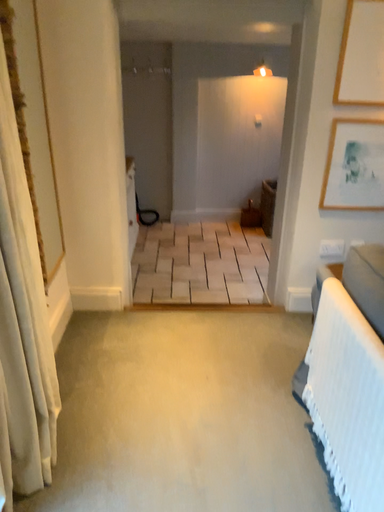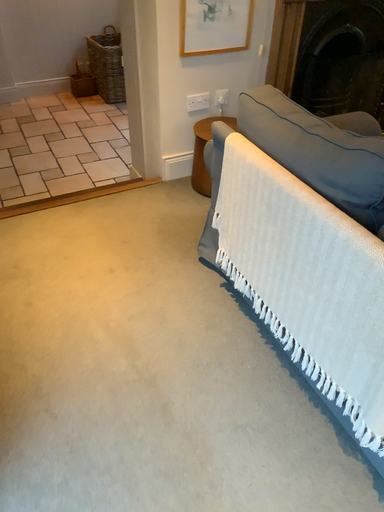
Question: How did the camera likely rotate when shooting the video?

Choices:
 (A) rotated upward
 (B) rotated downward

Answer: (B)